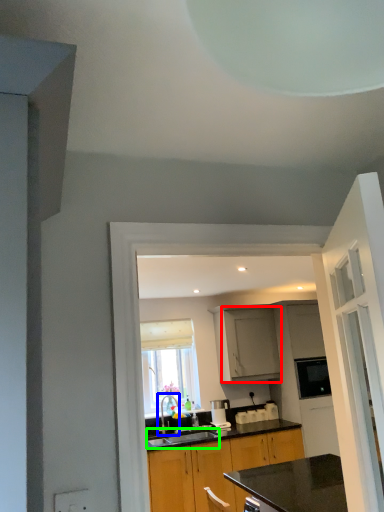
Question: Which is farther away from cabinetry (highlighted by a red box)? tap (highlighted by a blue box) or sink (highlighted by a green box)?

Choices:
 (A) tap
 (B) sink

Answer: (A)